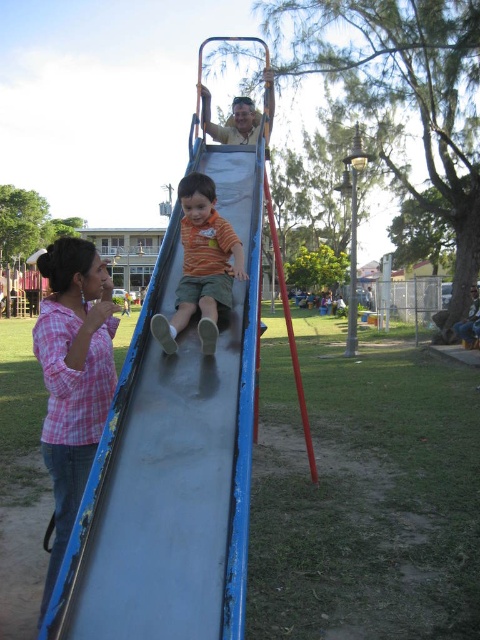
Question: Among these points, which one is farthest from the camera?

Choices:
 (A) (257, 116)
 (B) (192, 288)
 (C) (233, 504)

Answer: (A)

Question: Can you confirm if pink plaid shirt at left is thinner than orange cotton shirt at center?

Choices:
 (A) yes
 (B) no

Answer: (A)

Question: In this image, where is pink plaid shirt at left located relative to blue jeans at lower right?

Choices:
 (A) above
 (B) below

Answer: (B)

Question: Which object appears closest to the camera in this image?

Choices:
 (A) smooth wooden slide at upper center
 (B) blue jeans at lower right
 (C) orange cotton shirt at center

Answer: (C)

Question: Is pink plaid shirt at left smaller than blue jeans at lower right?

Choices:
 (A) no
 (B) yes

Answer: (B)

Question: Based on their relative distances, which object is nearer to the pink plaid shirt at left?

Choices:
 (A) orange cotton shirt at center
 (B) smooth wooden slide at upper center
 (C) blue jeans at lower right

Answer: (A)